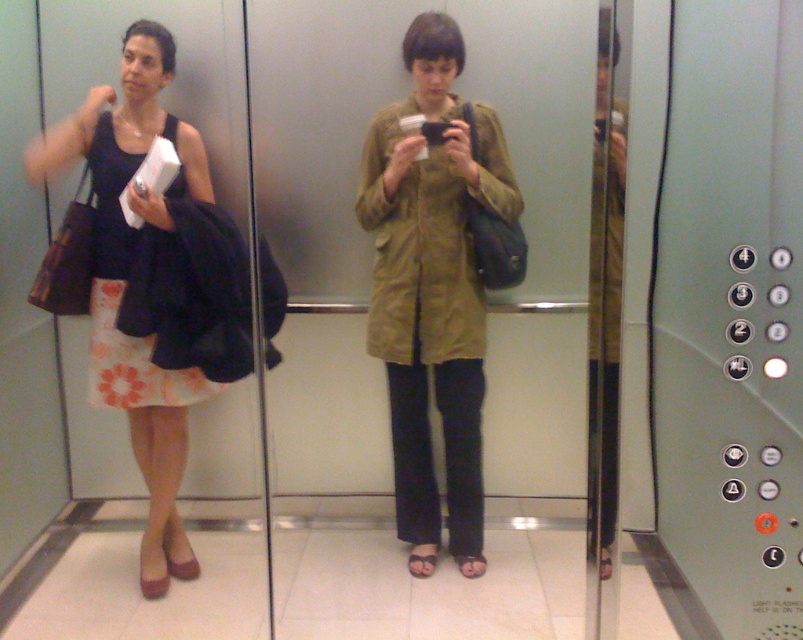
Question: Can you confirm if matte olive green jacket at center is bigger than matte black dress at left?

Choices:
 (A) yes
 (B) no

Answer: (B)

Question: Is matte olive green jacket at center wider than matte black dress at left?

Choices:
 (A) yes
 (B) no

Answer: (B)

Question: Which of the following is the closest to the observer?

Choices:
 (A) pos(459,525)
 (B) pos(104,88)

Answer: (B)

Question: Among these objects, which one is farthest from the camera?

Choices:
 (A) matte olive green jacket at center
 (B) matte black dress at left

Answer: (A)

Question: Which point is farther from the camera taking this photo?

Choices:
 (A) (153, 80)
 (B) (410, 250)
 (C) (284, 163)

Answer: (C)

Question: Does matte olive green jacket at center appear over matte black dress at left?

Choices:
 (A) no
 (B) yes

Answer: (B)